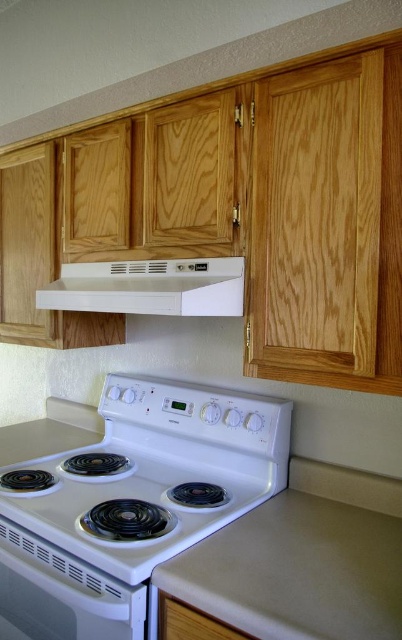
You are standing in the kitchen and want to reach a point that is 5.05 feet away from you. Can you confirm if the point you are aiming for is the point at coordinates point (274, 419)?

The distance of point (274, 419) from camera is 5.05 feet, so yes, the point you are aiming for is indeed the point at coordinates point (274, 419).

You are a kitchen designer planning to place a new appliance between the beige laminate counter top at lower center and the white matte exhaust hood at center. Which object should the appliance be placed closer to if it needs to be near the smaller one?

The beige laminate counter top at lower center is smaller than the white matte exhaust hood at center, so the appliance should be placed closer to the beige laminate counter top at lower center.